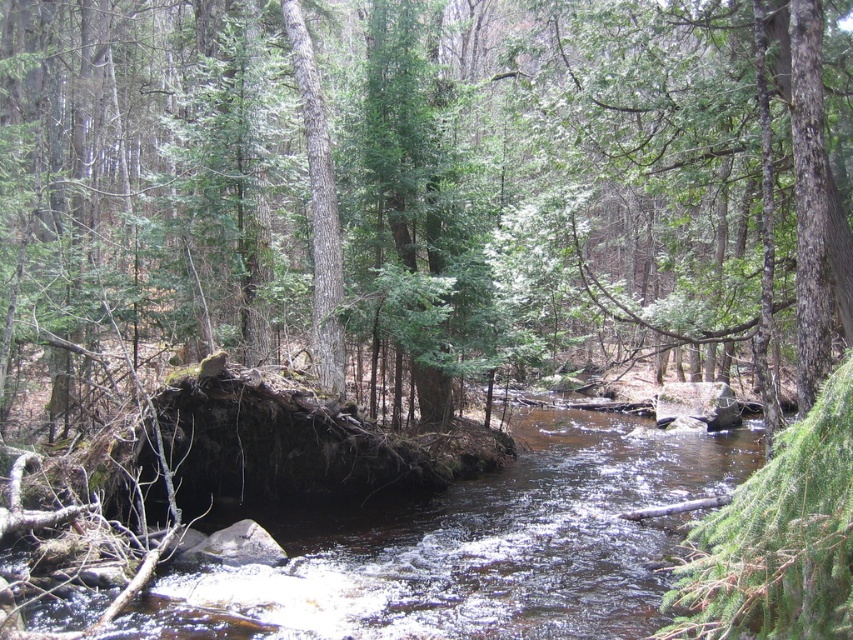
Question: Can you confirm if brown rough log at center is positioned below brown/rocky water at center?

Choices:
 (A) no
 (B) yes

Answer: (A)

Question: Can you confirm if brown rough log at center is positioned above brown/rocky water at center?

Choices:
 (A) no
 (B) yes

Answer: (B)

Question: Which object is farther from the camera taking this photo?

Choices:
 (A) brown/rocky water at center
 (B) brown rough log at center

Answer: (B)

Question: Observing the image, what is the correct spatial positioning of brown rough log at center in reference to brown/rocky water at center?

Choices:
 (A) above
 (B) below

Answer: (A)

Question: Which object appears farthest from the camera in this image?

Choices:
 (A) brown/rocky water at center
 (B) brown rough log at center

Answer: (B)

Question: Which of the following is the farthest from the observer?

Choices:
 (A) brown/rocky water at center
 (B) brown rough log at center

Answer: (B)